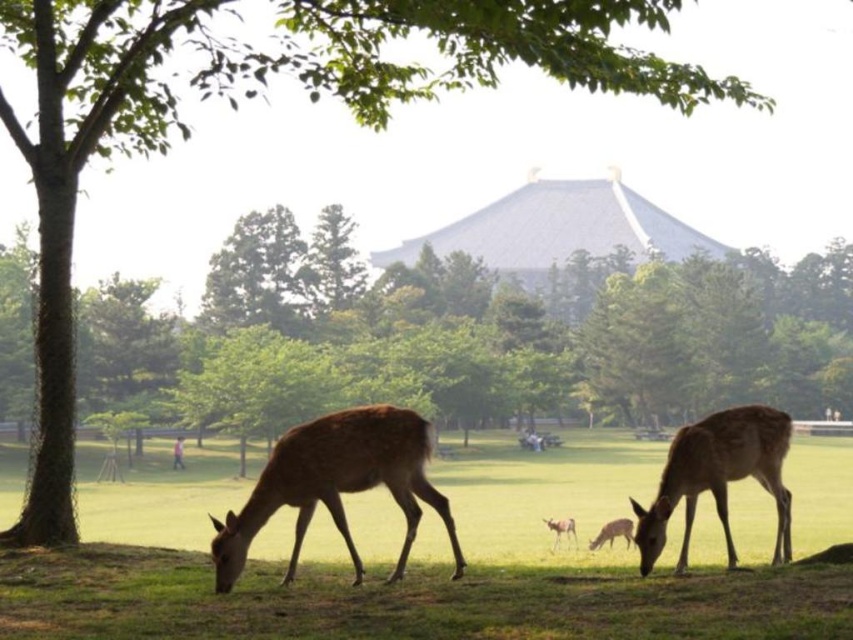
You are standing in the park and want to place a picnic blanket. The coordinates given are for the green grassy at lower center. Is this location suitable for placing a picnic blanket?

The green grassy at lower center is located at coordinates point (425, 563), so yes, this location is suitable for placing a picnic blanket as it is a grassy area.

You are standing in the park and want to walk from point (196, 500) to point (564, 520). Which direction should you face to move towards the latter point?

You should face away from the building to move from point (196, 500) to point (564, 520) since point (196, 500) is closer to you than point (564, 520).